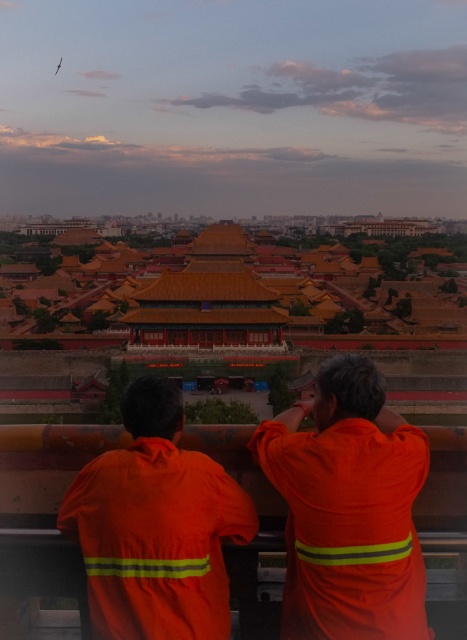
You are standing in the Forbidden City and want to take a photo of the orange fabric jacket at center. According to the coordinates provided, where should you position yourself to capture the jacket in the frame?

The orange fabric jacket at center is located at point (347, 509), so you should position yourself facing that coordinate to capture it in the frame.